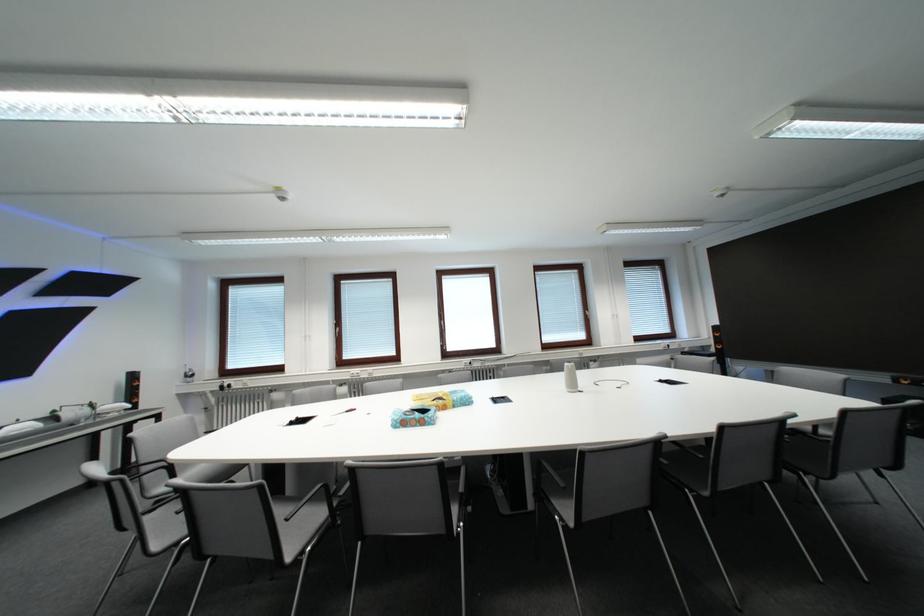
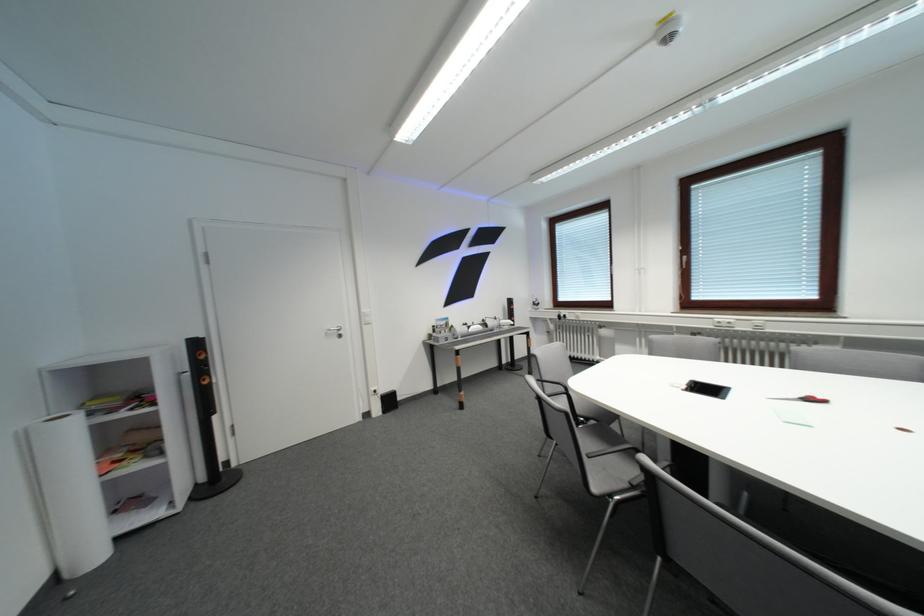
Question: Based on the continuous images, in which direction is the camera rotating? Reply with the corresponding letter.

Choices:
 (A) Left
 (B) Right
 (C) Up
 (D) Down

Answer: (A)